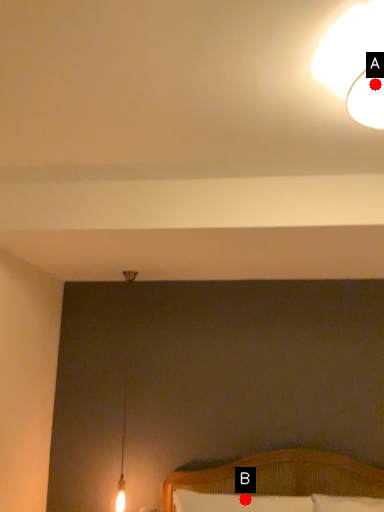
Question: Two points are circled on the image, labeled by A and B beside each circle. Which point is farther from the camera taking this photo?

Choices:
 (A) A is further
 (B) B is further

Answer: (B)